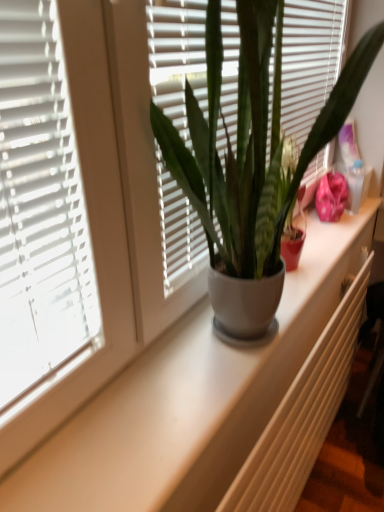
What do you see at coordinates (250, 141) in the screenshot?
I see `matte gray pot at center` at bounding box center [250, 141].

The height and width of the screenshot is (512, 384). In order to click on matte gray pot at center in this screenshot , I will do `click(250, 141)`.

Where is `white textured radiator at center`? white textured radiator at center is located at coordinates (302, 415).

The height and width of the screenshot is (512, 384). What do you see at coordinates (302, 415) in the screenshot?
I see `white textured radiator at center` at bounding box center [302, 415].

What are the coordinates of `matte gray pot at center` in the screenshot? It's located at (250, 141).

Visually, is white textured radiator at center positioned to the left or to the right of matte gray pot at center?

Clearly, white textured radiator at center is on the right of matte gray pot at center in the image.

Between white textured radiator at center and matte gray pot at center, which one is positioned behind?

white textured radiator at center is behind.

Is point (344, 324) closer or farther from the camera than point (244, 136)?

Point (344, 324) appears to be farther away from the viewer than point (244, 136).

From the image's perspective, which one is positioned higher, white textured radiator at center or matte gray pot at center?

matte gray pot at center, from the image's perspective.

From a real-world perspective, is white textured radiator at center positioned under matte gray pot at center based on gravity?

Yes.

Between white textured radiator at center and matte gray pot at center, which one has larger width?

Wider between the two is matte gray pot at center.

In terms of height, does white textured radiator at center look taller or shorter compared to matte gray pot at center?

Considering their sizes, white textured radiator at center has less height than matte gray pot at center.

From the picture: Considering the relative sizes of white textured radiator at center and matte gray pot at center in the image provided, is white textured radiator at center smaller than matte gray pot at center?

Yes, white textured radiator at center is smaller than matte gray pot at center.

Is white textured radiator at center not inside matte gray pot at center?

Yes, white textured radiator at center is located beyond the bounds of matte gray pot at center.

Is white textured radiator at center not close to matte gray pot at center?

That's not correct — white textured radiator at center is a little close to matte gray pot at center.

Is white textured radiator at center oriented towards matte gray pot at center?

No, white textured radiator at center is not turned towards matte gray pot at center.

How many degrees apart are the facing directions of white textured radiator at center and matte gray pot at center?

The facing directions of white textured radiator at center and matte gray pot at center are 0.461 degrees apart.

Locate an element on the screen. houseplant in front of the white textured radiator at center is located at coordinates (250, 141).

Between matte gray pot at center and white textured radiator at center, which one appears on the left side from the viewer's perspective?

Positioned to the left is matte gray pot at center.

Relative to white textured radiator at center, is matte gray pot at center in front or behind?

matte gray pot at center is positioned closer to the viewer than white textured radiator at center.

Between point (201, 155) and point (231, 510), which one is positioned behind?

The point (231, 510) is more distant.

From the image's perspective, is matte gray pot at center over white textured radiator at center?

Yes.

From a real-world perspective, is matte gray pot at center on top of white textured radiator at center?

Indeed, from a real-world perspective, matte gray pot at center stands above white textured radiator at center.

Is matte gray pot at center thinner than white textured radiator at center?

No, matte gray pot at center is not thinner than white textured radiator at center.

Does matte gray pot at center have a greater height compared to white textured radiator at center?

Yes, matte gray pot at center is taller than white textured radiator at center.

Considering the sizes of objects matte gray pot at center and white textured radiator at center in the image provided, who is bigger, matte gray pot at center or white textured radiator at center?

Bigger between the two is matte gray pot at center.

Is matte gray pot at center positioned beyond the bounds of white textured radiator at center?

Absolutely, matte gray pot at center is external to white textured radiator at center.

Are matte gray pot at center and white textured radiator at center beside each other?

matte gray pot at center and white textured radiator at center are clearly separated.

Could you tell me if matte gray pot at center is facing white textured radiator at center?

No, matte gray pot at center does not turn towards white textured radiator at center.

How many degrees apart are the facing directions of matte gray pot at center and white textured radiator at center?

0.461 degrees separate the facing orientations of matte gray pot at center and white textured radiator at center.

Measure the distance between matte gray pot at center and white textured radiator at center.

matte gray pot at center is 20.59 inches from white textured radiator at center.

You are a GUI agent. You are given a task and a screenshot of the screen. Output one action in this format:
    pyautogui.click(x=<x>, y=<y>)
    Task: Click on the radiator located behind the matte gray pot at center
    The width and height of the screenshot is (384, 512).
    Given the screenshot: What is the action you would take?
    pyautogui.click(x=302, y=415)

Find the location of `radiator that appears below the matte gray pot at center (from a real-world perspective)`. radiator that appears below the matte gray pot at center (from a real-world perspective) is located at coordinates (302, 415).

In the image, there is a matte gray pot at center. Identify the location of radiator below it (from the image's perspective). (302, 415).